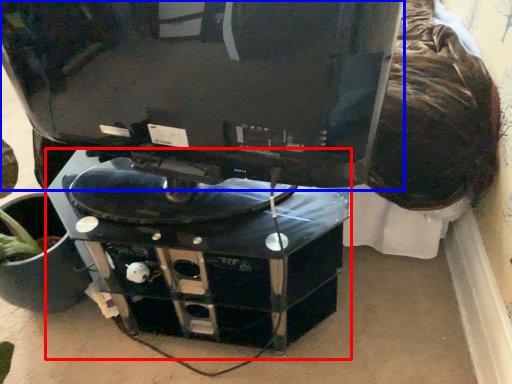
Question: Which object appears farthest to the camera in this image, computer desk (highlighted by a red box) or computer monitor (highlighted by a blue box)?

Choices:
 (A) computer desk
 (B) computer monitor

Answer: (A)